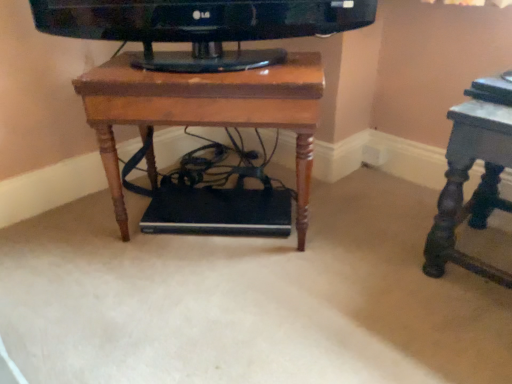
Where is `free point to the right of wooden table at center, arranged as the first table when viewed from the left`? Image resolution: width=512 pixels, height=384 pixels. free point to the right of wooden table at center, arranged as the first table when viewed from the left is located at coordinates (369, 225).